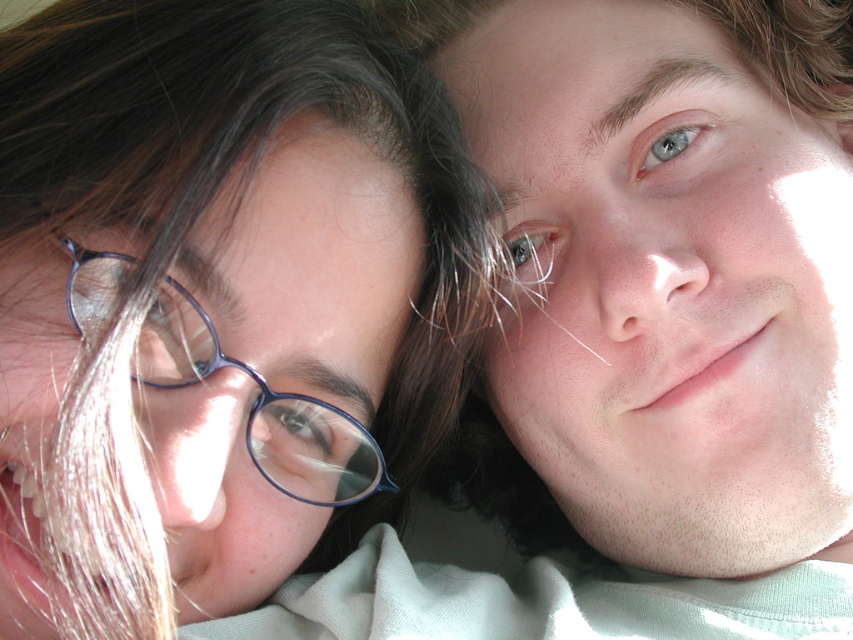
Question: Which object is the closest to the blue plastic glasses at left?

Choices:
 (A) smooth skin face at upper right
 (B) matte blue glasses at center

Answer: (B)

Question: Can you confirm if matte blue glasses at center is positioned to the right of smooth skin face at upper right?

Choices:
 (A) yes
 (B) no

Answer: (B)

Question: Which point is closer to the camera taking this photo?

Choices:
 (A) (352, 500)
 (B) (302, 417)

Answer: (B)

Question: Which point appears closest to the camera in this image?

Choices:
 (A) (318, 342)
 (B) (744, 524)

Answer: (A)

Question: Does smooth skin face at upper right appear under blue plastic glasses at left?

Choices:
 (A) no
 (B) yes

Answer: (A)

Question: Is matte blue glasses at center further to the viewer compared to smooth skin face at upper right?

Choices:
 (A) no
 (B) yes

Answer: (A)